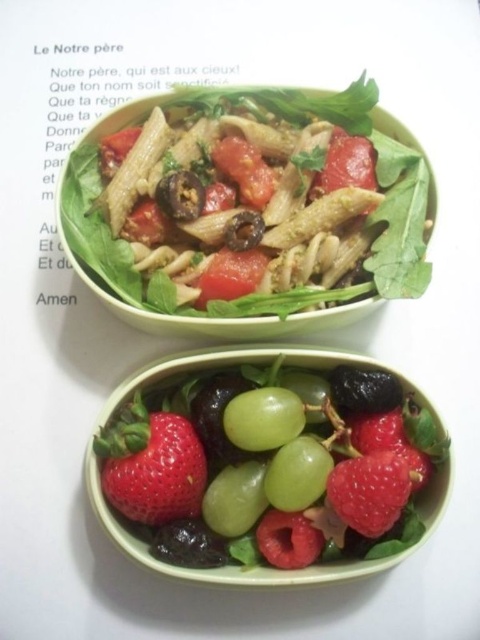
You are arranging fruits on a plate and see the green matte grape at center and the red matte strawberry at lower right. Which fruit is placed higher up?

The green matte grape at center is positioned over the red matte strawberry at lower right, so it is placed higher up.

You are a food delivery person who needs to place a red matte strawberry at lower right into a box. The box is already holding the green matte pasta salad at upper center. Can you place the strawberry in front of the pasta salad so that it is visible when the box is opened?

The red matte strawberry at lower right is behind the green matte pasta salad at upper center, so placing it behind would mean it is not visible. To make it visible, you should place it in front of the pasta salad instead.

You are a food delivery robot that needs to pick up two points marked on the table. The first point is at coordinate point (x=238, y=410) and the second is at point (x=192, y=484). Since you can only reach one point at a time, which point should you reach first to ensure you can access both without moving your base position?

You should reach point (x=238, y=410) first because it is closer to you than point (x=192, y=484), allowing you to access both points without needing to reposition your base.